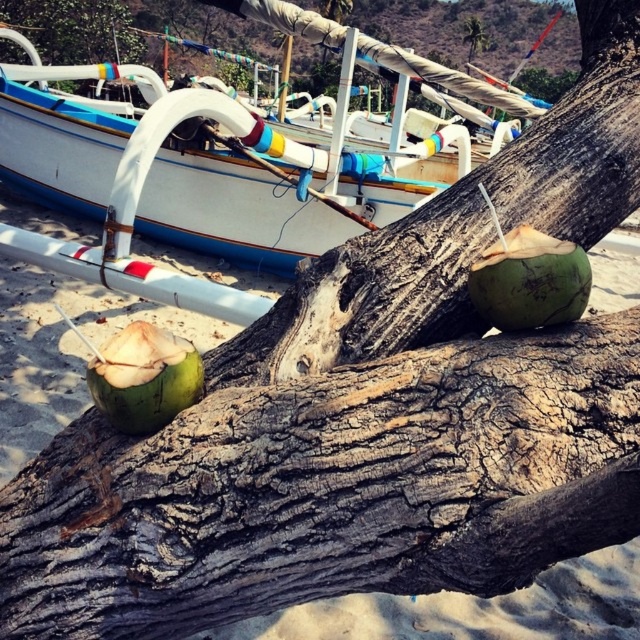
Who is higher up, green matte coconut at center or green rough bark tree at upper center?

green rough bark tree at upper center is above.

How distant is green matte coconut at center from green rough bark tree at upper center?

The distance of green matte coconut at center from green rough bark tree at upper center is 76.34 feet.

Measure the distance between point [547,289] and camera.

1.66 meters

The height and width of the screenshot is (640, 640). In order to click on green matte coconut at center in this screenshot , I will do (529, 280).

Can you confirm if green matte coconut at center is smaller than brown rough tree trunk at upper left?

Correct, green matte coconut at center occupies less space than brown rough tree trunk at upper left.

Who is more forward, (570,273) or (26,26)?

Positioned in front is point (570,273).

This screenshot has height=640, width=640. Find the location of `green matte coconut at center`. green matte coconut at center is located at coordinates (529, 280).

Is green rough coconut at center to the right of brown rough tree trunk at upper left from the viewer's perspective?

Correct, you'll find green rough coconut at center to the right of brown rough tree trunk at upper left.

Can you confirm if green rough coconut at center is positioned to the left of brown rough tree trunk at upper left?

In fact, green rough coconut at center is to the right of brown rough tree trunk at upper left.

The image size is (640, 640). I want to click on green rough coconut at center, so click(145, 378).

This screenshot has height=640, width=640. I want to click on green rough coconut at center, so click(x=145, y=378).